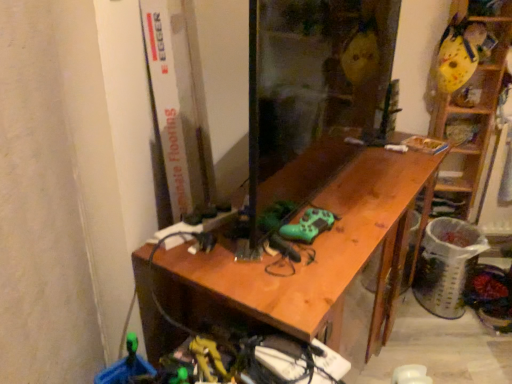
Question: Does wooden at right appear on the right side of wooden desk at center?

Choices:
 (A) yes
 (B) no

Answer: (A)

Question: From a real-world perspective, is wooden at right located beneath wooden desk at center?

Choices:
 (A) no
 (B) yes

Answer: (A)

Question: Is wooden at right far away from wooden desk at center?

Choices:
 (A) yes
 (B) no

Answer: (B)

Question: Is wooden at right not inside wooden desk at center?

Choices:
 (A) no
 (B) yes

Answer: (B)

Question: From a real-world perspective, is wooden at right on top of wooden desk at center?

Choices:
 (A) no
 (B) yes

Answer: (B)

Question: From the image's perspective, is wooden at right below wooden desk at center?

Choices:
 (A) no
 (B) yes

Answer: (A)

Question: Can you see wooden desk at center touching wooden at right?

Choices:
 (A) no
 (B) yes

Answer: (A)

Question: Does wooden desk at center have a greater width compared to wooden at right?

Choices:
 (A) yes
 (B) no

Answer: (A)

Question: From the image's perspective, is wooden desk at center under wooden at right?

Choices:
 (A) no
 (B) yes

Answer: (B)

Question: Considering the relative positions of wooden desk at center and wooden at right in the image provided, is wooden desk at center to the left of wooden at right from the viewer's perspective?

Choices:
 (A) no
 (B) yes

Answer: (B)

Question: Can you confirm if wooden desk at center is thinner than wooden at right?

Choices:
 (A) no
 (B) yes

Answer: (A)

Question: Is wooden at right located within wooden desk at center?

Choices:
 (A) yes
 (B) no

Answer: (B)

Question: Is wooden desk at center wider or thinner than wooden at right?

Choices:
 (A) thin
 (B) wide

Answer: (B)